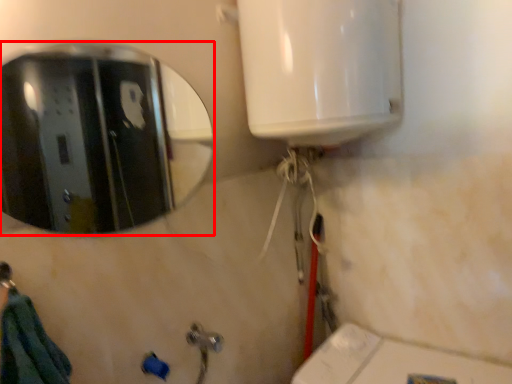
Question: From the image, what is the correct spatial relationship of mirror (annotated by the red box) in relation to shower?

Choices:
 (A) right
 (B) left

Answer: (A)